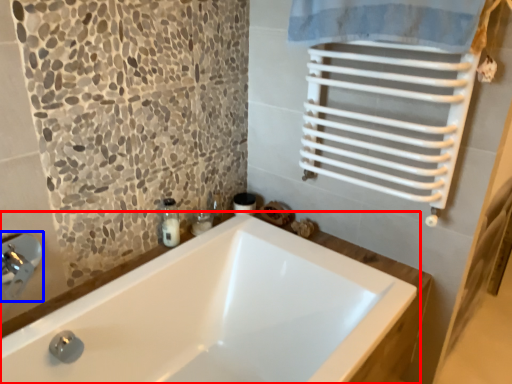
Question: Among these objects, which one is nearest to the camera, bathtub (highlighted by a red box) or faucet (highlighted by a blue box)?

Choices:
 (A) bathtub
 (B) faucet

Answer: (A)